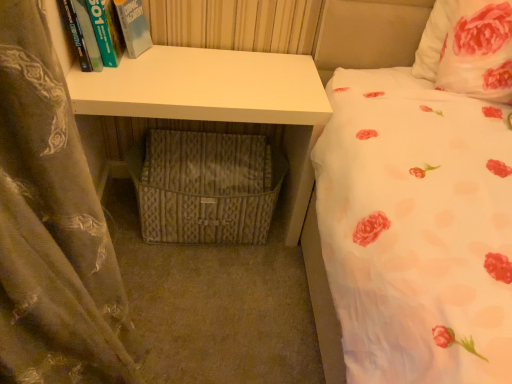
The width and height of the screenshot is (512, 384). I want to click on white matte desk at center, so click(219, 100).

Where is `woven fabric crate at lower center`? This screenshot has height=384, width=512. woven fabric crate at lower center is located at coordinates (205, 187).

From the image's perspective, which is below, hardcover book at upper left or white floral fabric pillow at upper right?

white floral fabric pillow at upper right, from the image's perspective.

Which is in front, point (110, 47) or point (492, 68)?

The point (492, 68) is closer to the camera.

Is hardcover book at upper left oriented towards white floral fabric pillow at upper right?

No.

At what (x,y) coordinates should I click in order to perform the action: click on pillow lying below the hardcover book at upper left (from the image's perspective). Please return your answer as a coordinate pair (x, y). Image resolution: width=512 pixels, height=384 pixels. Looking at the image, I should click on (468, 48).

Does point (14, 50) come in front of point (488, 79)?

Yes, it is in front of point (488, 79).

From a real-world perspective, does brown sheer curtain at left sit lower than white floral fabric pillow at upper right?

Correct, in the physical world, brown sheer curtain at left is lower than white floral fabric pillow at upper right.

Could white floral fabric pillow at upper right be considered to be inside brown sheer curtain at left?

No.

Considering the sizes of brown sheer curtain at left and white floral fabric pillow at upper right in the image, is brown sheer curtain at left taller or shorter than white floral fabric pillow at upper right?

Considering their sizes, brown sheer curtain at left has more height than white floral fabric pillow at upper right.

Does white floral fabric pillow at upper right have a lesser height compared to brown sheer curtain at left?

Correct, white floral fabric pillow at upper right is not as tall as brown sheer curtain at left.

Is white floral fabric pillow at upper right at the right side of brown sheer curtain at left?

Yes, white floral fabric pillow at upper right is to the right of brown sheer curtain at left.

Is white floral fabric pillow at upper right further to the viewer compared to brown sheer curtain at left?

Yes, white floral fabric pillow at upper right is further from the camera.

From the image's perspective, is white floral fabric pillow at upper right positioned above or below brown sheer curtain at left?

Clearly, from the image's perspective, white floral fabric pillow at upper right is above brown sheer curtain at left.

Is hardcover book at upper left touching white matte desk at center?

hardcover book at upper left is not next to white matte desk at center, and they're not touching.

Image resolution: width=512 pixels, height=384 pixels. Identify the location of desk located underneath the hardcover book at upper left (from a real-world perspective). (219, 100).

Is hardcover book at upper left further to the viewer compared to white matte desk at center?

No, it is not.

How different are the orientations of hardcover book at upper left and white matte desk at center in degrees?

The angle between the facing direction of hardcover book at upper left and the facing direction of white matte desk at center is 0.000292 degrees.

In the scene shown: Is the surface of white floral fabric pillow at upper right in direct contact with white matte desk at center?

No, white floral fabric pillow at upper right is not touching white matte desk at center.

How distant is white floral fabric pillow at upper right from white matte desk at center?

22.80 inches.

Considering the sizes of objects white floral fabric pillow at upper right and white matte desk at center in the image provided, who is wider, white floral fabric pillow at upper right or white matte desk at center?

Wider between the two is white matte desk at center.

From a real-world perspective, is white floral fabric pillow at upper right physically located above or below white matte desk at center?

white floral fabric pillow at upper right is above white matte desk at center.

The height and width of the screenshot is (384, 512). In order to click on desk on the left of white floral fabric pillow at upper right in this screenshot , I will do `click(219, 100)`.

Based on their positions, is white matte desk at center located to the left or right of white floral fabric pillow at upper right?

white matte desk at center is positioned on white floral fabric pillow at upper right's left side.

Does white matte desk at center touch white floral fabric pillow at upper right?

No.

Which is less distant, (132, 170) or (474, 37)?

Point (132, 170) is farther from the camera than point (474, 37).

Measure the distance from woven fabric crate at lower center to white floral fabric pillow at upper right.

A distance of 33.23 inches exists between woven fabric crate at lower center and white floral fabric pillow at upper right.

Considering the relative sizes of woven fabric crate at lower center and white floral fabric pillow at upper right in the image provided, is woven fabric crate at lower center smaller than white floral fabric pillow at upper right?

No, woven fabric crate at lower center is not smaller than white floral fabric pillow at upper right.

From their relative heights in the image, would you say woven fabric crate at lower center is taller or shorter than white floral fabric pillow at upper right?

Considering their sizes, woven fabric crate at lower center has less height than white floral fabric pillow at upper right.

The width and height of the screenshot is (512, 384). What are the coordinates of `pillow above the hardcover book at upper left (from a real-world perspective)` in the screenshot? It's located at (468, 48).

In order to click on pillow that is behind the brown sheer curtain at left in this screenshot , I will do `click(468, 48)`.

Which object lies nearer to the anchor point white matte desk at center, hardcover book at upper left or white floral fabric pillow at upper right?

Among the two, hardcover book at upper left is located nearer to white matte desk at center.

Looking at the image, which one is located further to brown sheer curtain at left, white floral fabric pillow at upper right or hardcover book at upper left?

white floral fabric pillow at upper right lies further to brown sheer curtain at left than the other object.

Considering their positions, is brown sheer curtain at left positioned closer to white floral fabric pillow at upper right than hardcover book at upper left?

hardcover book at upper left is positioned closer to the anchor white floral fabric pillow at upper right.

Which object lies further to the anchor point hardcover book at upper left, brown sheer curtain at left or woven fabric crate at lower center?

The object further to hardcover book at upper left is brown sheer curtain at left.

Looking at the image, which one is located closer to white matte desk at center, brown sheer curtain at left or white floral fabric pillow at upper right?

white floral fabric pillow at upper right is positioned closer to the anchor white matte desk at center.

Looking at the image, which one is located closer to hardcover book at upper left, woven fabric crate at lower center or white floral fabric pillow at upper right?

woven fabric crate at lower center is closer to hardcover book at upper left.

Looking at the image, which one is located closer to hardcover book at upper left, white floral fabric pillow at upper right or white matte desk at center?

The object closer to hardcover book at upper left is white matte desk at center.

From the image, which object appears to be farther from woven fabric crate at lower center, white matte desk at center or white floral fabric pillow at upper right?

white floral fabric pillow at upper right.

Where is `curtain between hardcover book at upper left and white floral fabric pillow at upper right from left to right`? The image size is (512, 384). curtain between hardcover book at upper left and white floral fabric pillow at upper right from left to right is located at coordinates (52, 227).

I want to click on pillow between brown sheer curtain at left and woven fabric crate at lower center from front to back, so click(x=468, y=48).

The width and height of the screenshot is (512, 384). I want to click on crate located between hardcover book at upper left and white floral fabric pillow at upper right in the left-right direction, so click(205, 187).

I want to click on desk between hardcover book at upper left and woven fabric crate at lower center from top to bottom, so click(x=219, y=100).